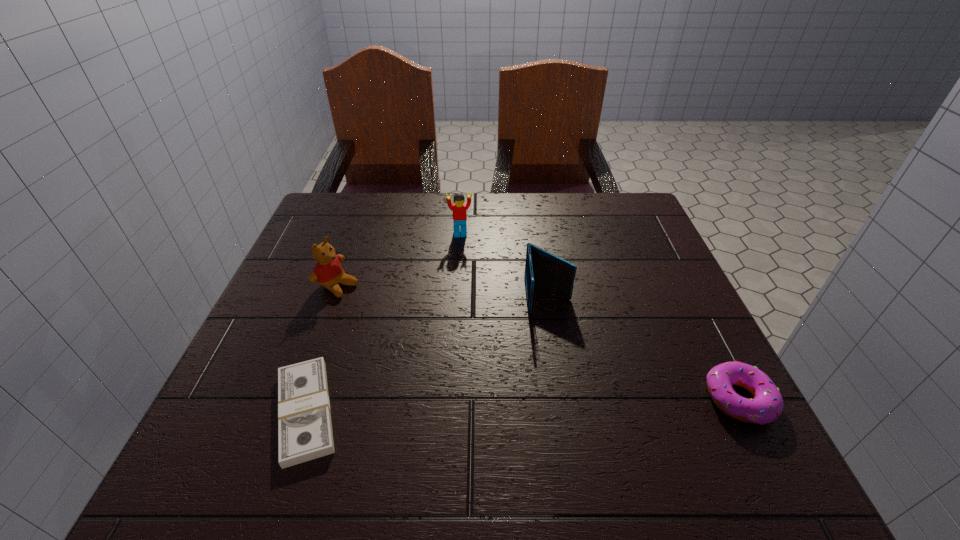
The height and width of the screenshot is (540, 960). I want to click on free location located 0.250m on the face of the farthest object, so click(474, 305).

Find the location of `vacant space located on the face of the farthest object`. vacant space located on the face of the farthest object is located at coordinates (468, 267).

Image resolution: width=960 pixels, height=540 pixels. What are the coordinates of `free region located on the face of the farthest object` in the screenshot? It's located at (482, 344).

What are the coordinates of `blank space located on the front-facing side of the teddy bear` in the screenshot? It's located at click(x=449, y=339).

Find the location of a particular element. free space located on the front-facing side of the teddy bear is located at coordinates (497, 362).

Identify the location of vacant space located on the front-facing side of the teddy bear. Image resolution: width=960 pixels, height=540 pixels. (449, 339).

Where is `vacant space located 0.230m on the exterior surface of the third shortest object`? vacant space located 0.230m on the exterior surface of the third shortest object is located at coordinates (566, 413).

What are the coordinates of `vacant space located 0.110m on the exterior surface of the third shortest object` in the screenshot? It's located at (558, 357).

Locate an element on the screen. This screenshot has height=540, width=960. free space located 0.190m on the exterior surface of the third shortest object is located at coordinates (564, 393).

Identify the location of object present at the far edge. (459, 208).